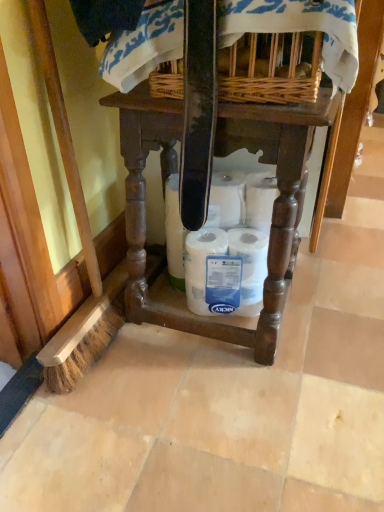
Question: Is wooden table at center positioned in front of white matte toilet paper at center?

Choices:
 (A) yes
 (B) no

Answer: (A)

Question: Is wooden table at center positioned behind white matte toilet paper at center?

Choices:
 (A) yes
 (B) no

Answer: (B)

Question: Is white matte toilet paper at center surrounded by wooden table at center?

Choices:
 (A) no
 (B) yes

Answer: (B)

Question: Can you confirm if wooden table at center is smaller than white matte toilet paper at center?

Choices:
 (A) yes
 (B) no

Answer: (B)

Question: Does wooden table at center have a lesser height compared to white matte toilet paper at center?

Choices:
 (A) no
 (B) yes

Answer: (A)

Question: Based on their sizes in the image, would you say wooden table at center is bigger or smaller than woven wicker basket at upper center?

Choices:
 (A) small
 (B) big

Answer: (B)

Question: Is wooden table at center situated inside woven wicker basket at upper center or outside?

Choices:
 (A) outside
 (B) inside

Answer: (A)

Question: Considering the relative positions of wooden table at center and woven wicker basket at upper center in the image provided, is wooden table at center to the left or to the right of woven wicker basket at upper center?

Choices:
 (A) right
 (B) left

Answer: (B)

Question: From a real-world perspective, relative to woven wicker basket at upper center, is wooden table at center vertically above or below?

Choices:
 (A) below
 (B) above

Answer: (A)

Question: Is white matte toilet paper at center inside or outside of woven wicker basket at upper center?

Choices:
 (A) inside
 (B) outside

Answer: (B)

Question: From the image's perspective, is white matte toilet paper at center positioned above or below woven wicker basket at upper center?

Choices:
 (A) below
 (B) above

Answer: (A)

Question: Based on their sizes in the image, would you say white matte toilet paper at center is bigger or smaller than woven wicker basket at upper center?

Choices:
 (A) big
 (B) small

Answer: (B)

Question: Considering the positions of point (175, 202) and point (230, 92), is point (175, 202) closer or farther from the camera than point (230, 92)?

Choices:
 (A) closer
 (B) farther

Answer: (B)

Question: From the image's perspective, is woven wicker basket at upper center above or below white matte toilet paper at center?

Choices:
 (A) below
 (B) above

Answer: (B)

Question: Visually, is woven wicker basket at upper center positioned to the left or to the right of white matte toilet paper at center?

Choices:
 (A) right
 (B) left

Answer: (B)